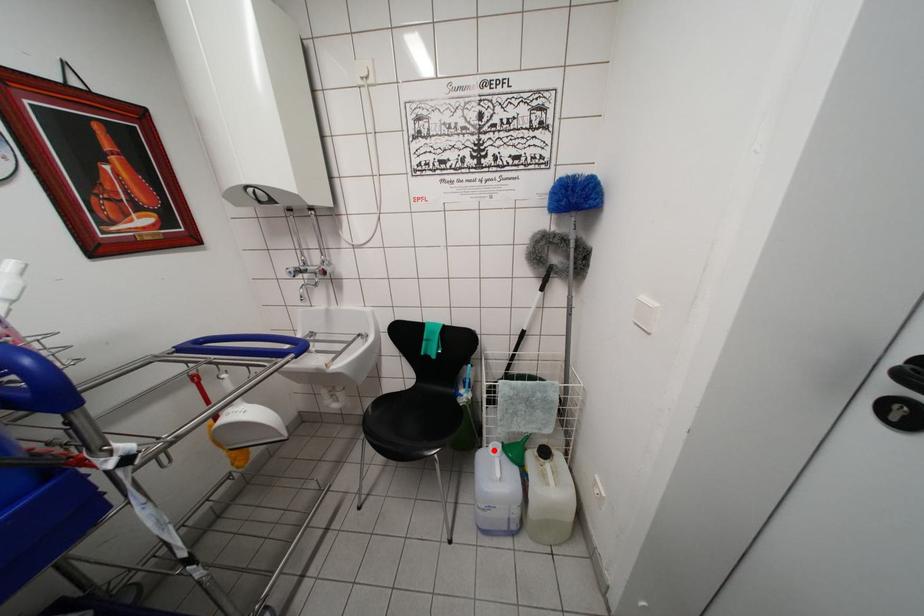
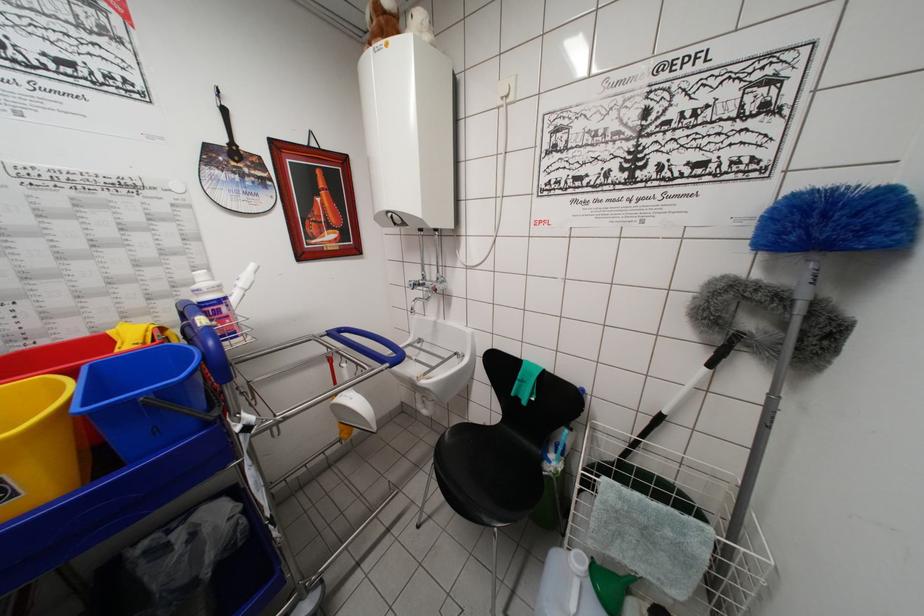
Find the pixel in the second image that matches the highlighted location in the first image.

(576, 557)